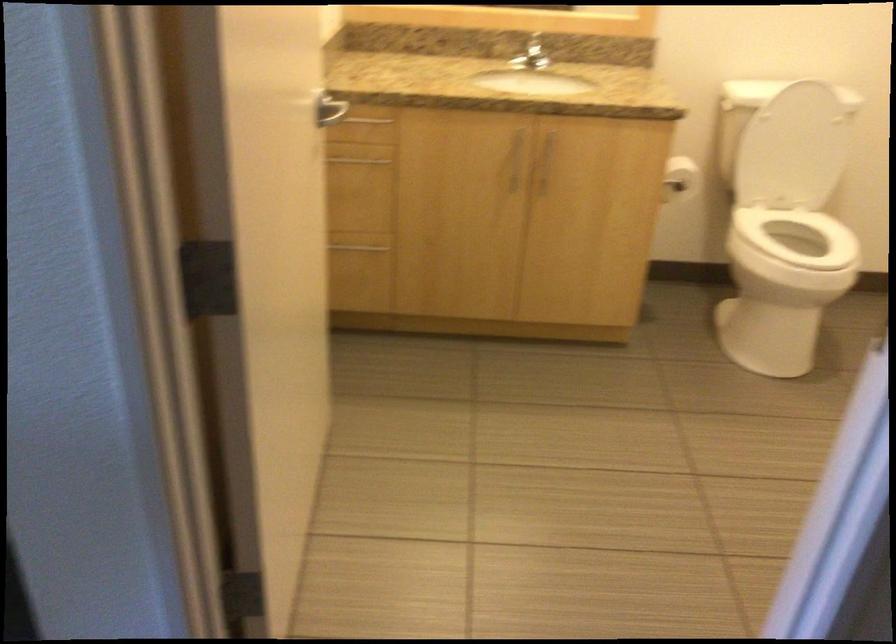
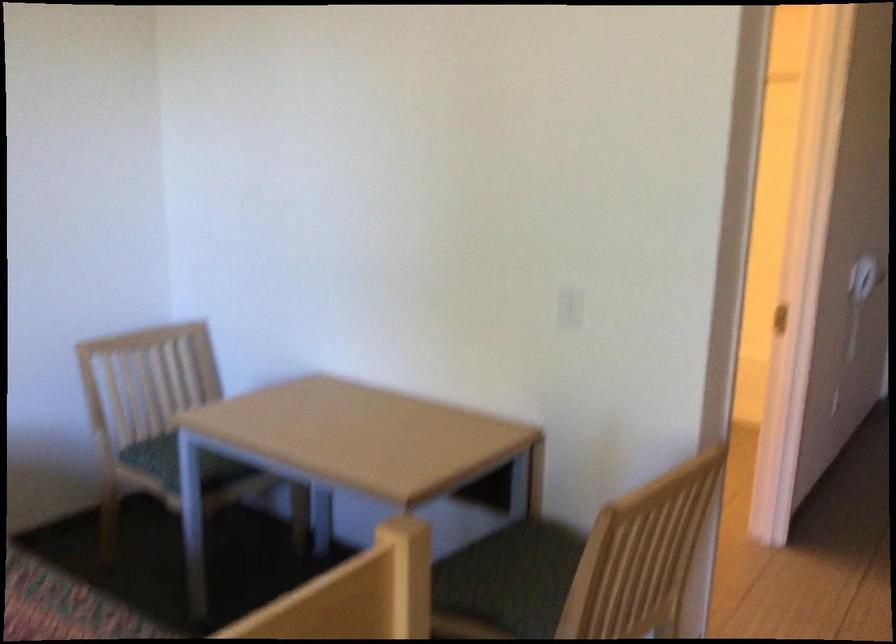
Question: I am providing you with two images of the same scene from different viewpoints. Please identify which objects are invisible in image2.

Choices:
 (A) chair sitting surface
 (B) faucet handle
 (C) pink heart pillow
 (D) white electrical outlet

Answer: (B)